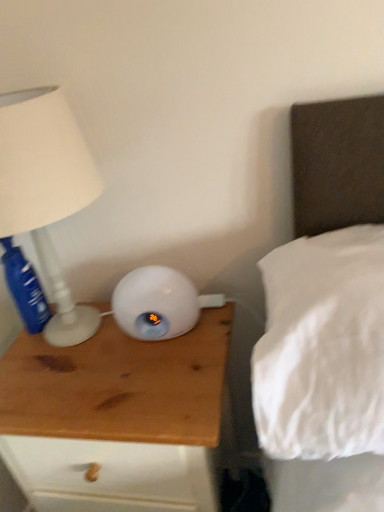
Find the location of a particular element. The image size is (384, 512). empty space that is ontop of wooden nightstand at left (from a real-world perspective) is located at coordinates (101, 356).